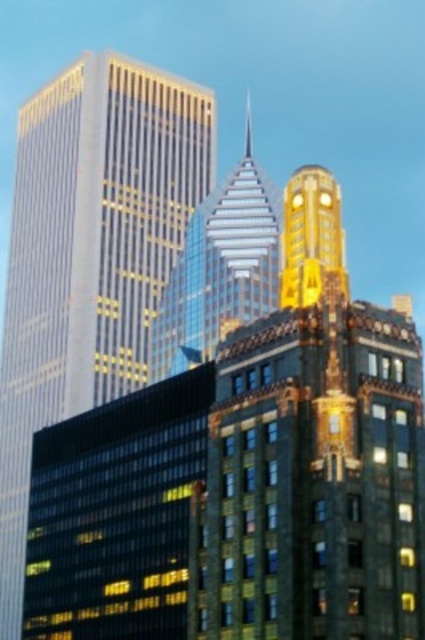
I want to click on gold textured building at center, so click(312, 456).

Between point (306, 205) and point (121, 300), which one is positioned behind?

The point (121, 300) is behind.

Identify the location of gold textured building at center. This screenshot has height=640, width=425. (312, 456).

Is point (320, 429) closer to camera compared to point (235, 244)?

Yes, it is.

Who is more distant from viewer, (x=402, y=480) or (x=183, y=288)?

The point (x=183, y=288) is behind.

This screenshot has width=425, height=640. Describe the element at coordinates (312, 456) in the screenshot. I see `gold textured building at center` at that location.

Find the location of a particular element. This screenshot has width=425, height=640. gold textured building at center is located at coordinates (312, 456).

Based on the photo, how much distance is there between gold glass skyscraper at left and shiny glass skyscraper at center?

gold glass skyscraper at left is 58.28 feet from shiny glass skyscraper at center.

Can you confirm if gold glass skyscraper at left is shorter than shiny glass skyscraper at center?

No, gold glass skyscraper at left is not shorter than shiny glass skyscraper at center.

Image resolution: width=425 pixels, height=640 pixels. What do you see at coordinates (90, 256) in the screenshot?
I see `gold glass skyscraper at left` at bounding box center [90, 256].

Find the location of a particular element. This screenshot has height=640, width=425. gold glass skyscraper at left is located at coordinates (90, 256).